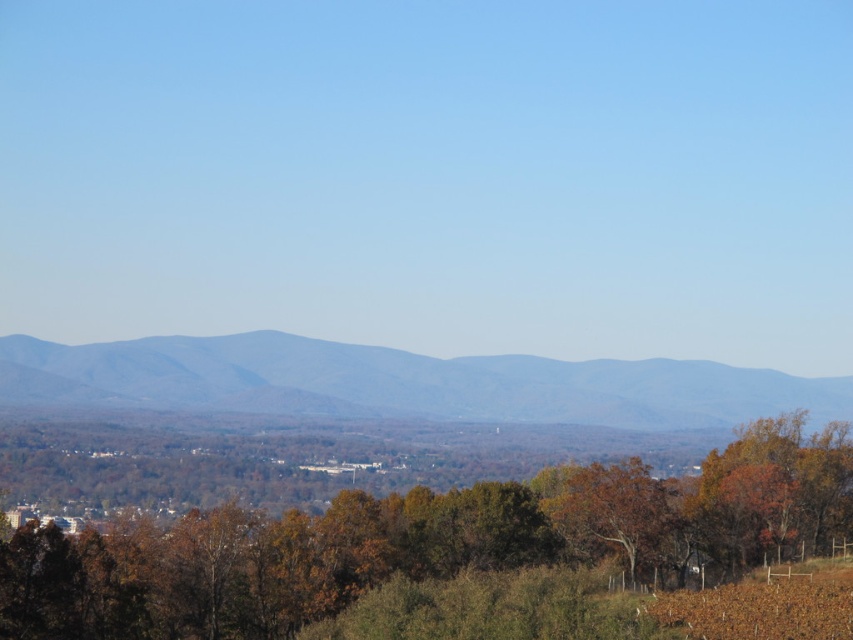
Measure the distance from brown matte tree at lower center to grayish-blue textured mountain at center.

The distance of brown matte tree at lower center from grayish-blue textured mountain at center is 120.05 meters.

Looking at this image, can you confirm if brown matte tree at lower center is wider than grayish-blue textured mountain at center?

In fact, brown matte tree at lower center might be narrower than grayish-blue textured mountain at center.

Which is behind, point (724, 522) or point (602, 387)?

Positioned behind is point (602, 387).

Image resolution: width=853 pixels, height=640 pixels. I want to click on brown matte tree at lower center, so click(x=431, y=541).